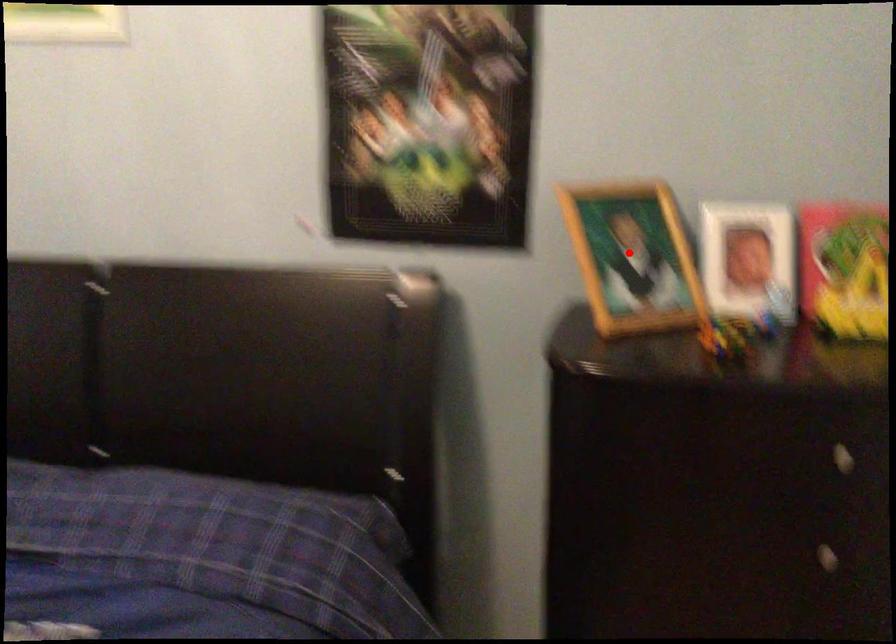
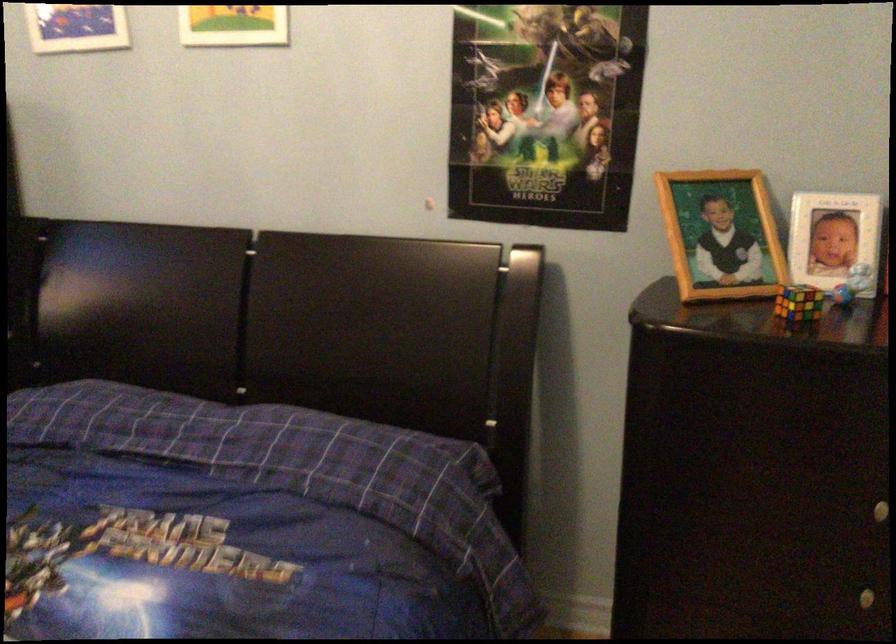
In the second image, find the point that corresponds to the highlighted location in the first image.

(720, 234)